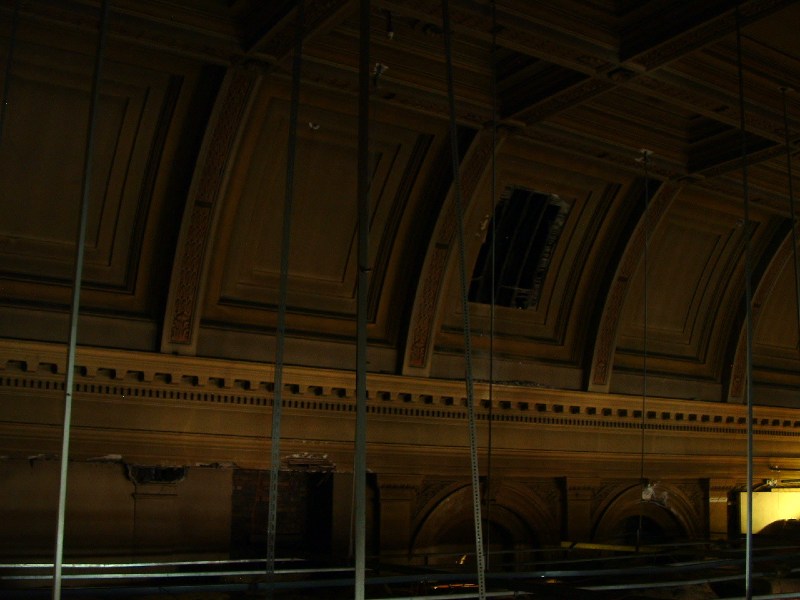
The height and width of the screenshot is (600, 800). I want to click on recessed area in the ceiling, so click(628, 109).